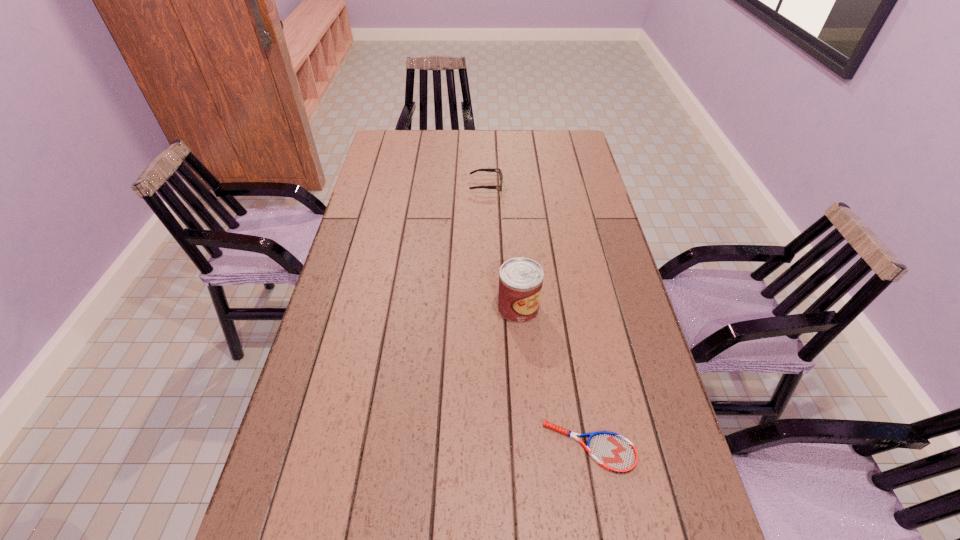
Identify the location of vacant area between the tallest object and the second tallest object. [502, 247].

Locate an element on the screen. This screenshot has width=960, height=540. free spot between the tennis racket and the can is located at coordinates (554, 377).

Where is `empty location between the nearest object and the tallest object`? The height and width of the screenshot is (540, 960). empty location between the nearest object and the tallest object is located at coordinates (554, 377).

Locate an element on the screen. This screenshot has height=540, width=960. empty location between the tennis racket and the sunglasses is located at coordinates (538, 316).

Where is `empty space that is in between the tennis racket and the sunglasses`? empty space that is in between the tennis racket and the sunglasses is located at coordinates (538, 316).

Identify the location of object that can be found as the second closest to the can. (485, 169).

Locate an element on the screen. The height and width of the screenshot is (540, 960). object identified as the closest to the shortest object is located at coordinates coord(520,279).

This screenshot has height=540, width=960. Find the location of `vacant point that satisfies the following two spatial constraints: 1. on the front-facing side of the farthest object; 2. on the back side of the second farthest object`. vacant point that satisfies the following two spatial constraints: 1. on the front-facing side of the farthest object; 2. on the back side of the second farthest object is located at coordinates 488,308.

Identify the location of vacant space that satisfies the following two spatial constraints: 1. on the back side of the shortest object; 2. on the front-facing side of the second tallest object. (543, 185).

Find the location of a particular element. The height and width of the screenshot is (540, 960). free space that satisfies the following two spatial constraints: 1. on the front-facing side of the tallest object; 2. on the left side of the second tallest object is located at coordinates (488, 308).